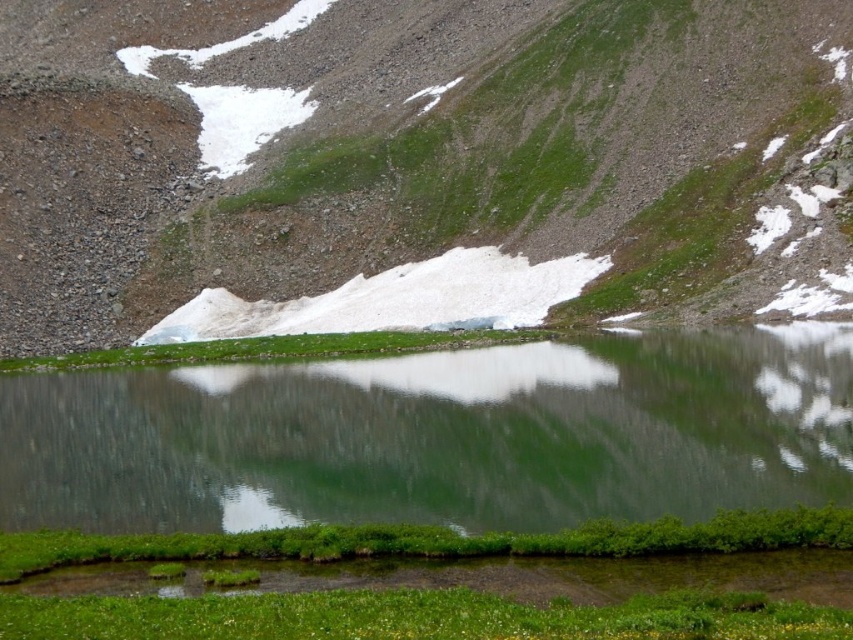
You are standing at the edge of the green reflective water at center and want to climb up to the green grassy hillside at center. Is the hillside higher than the water level?

The green grassy hillside at center is taller than green reflective water at center, so yes, the hillside is higher than the water level.

You are planning to take a photo of the green grassy hillside at center and the green reflective water at center. Which object should you focus on first if you want to capture both in a single frame without moving the camera?

The green grassy hillside at center has a larger size compared to green reflective water at center, so you should focus on the larger object first to ensure both are in focus.

You are a hiker planning to cross the green reflective water at center. The path you want to take is along the green grassy hillside at center. Since the hillside is wider than the water, will you have enough space to walk around the water safely?

The green grassy hillside at center is wider than the green reflective water at center, so yes, there is enough space to walk around the water safely along the hillside.